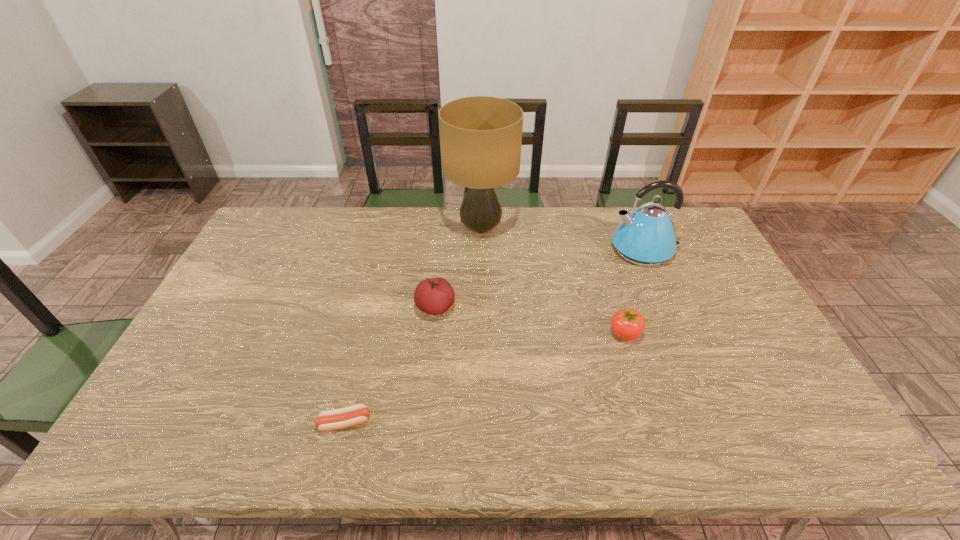
I want to click on vacant area that lies between the shortest object and the third shortest object, so click(390, 365).

The height and width of the screenshot is (540, 960). Find the location of `vacant region between the lampshade and the shortest object`. vacant region between the lampshade and the shortest object is located at coordinates (413, 325).

This screenshot has width=960, height=540. In order to click on free space between the lampshade and the third shortest object in this screenshot , I will do `click(458, 267)`.

You are a GUI agent. You are given a task and a screenshot of the screen. Output one action in this format:
    pyautogui.click(x=<x>, y=<y>)
    Task: Click on the empty space between the tallest object and the third shortest object
    The image size is (960, 540).
    Given the screenshot: What is the action you would take?
    pyautogui.click(x=458, y=267)

Where is `free area in between the shortest object and the shorter tomato`? free area in between the shortest object and the shorter tomato is located at coordinates (485, 378).

In order to click on empty location between the shorter tomato and the third tallest object in this screenshot , I will do `click(530, 321)`.

Where is `object that is the closest to the kettle`? The height and width of the screenshot is (540, 960). object that is the closest to the kettle is located at coordinates (628, 324).

At what (x,y) coordinates should I click in order to perform the action: click on the closest object to the right tomato. Please return your answer as a coordinate pair (x, y). This screenshot has width=960, height=540. Looking at the image, I should click on (646, 237).

Image resolution: width=960 pixels, height=540 pixels. Find the location of `vacant position in the image that satisfies the following two spatial constraints: 1. at the spout of the kettle; 2. on the front side of the leftmost object`. vacant position in the image that satisfies the following two spatial constraints: 1. at the spout of the kettle; 2. on the front side of the leftmost object is located at coordinates (718, 422).

This screenshot has height=540, width=960. I want to click on vacant space that satisfies the following two spatial constraints: 1. at the spout of the kettle; 2. on the front side of the taller tomato, so click(x=669, y=307).